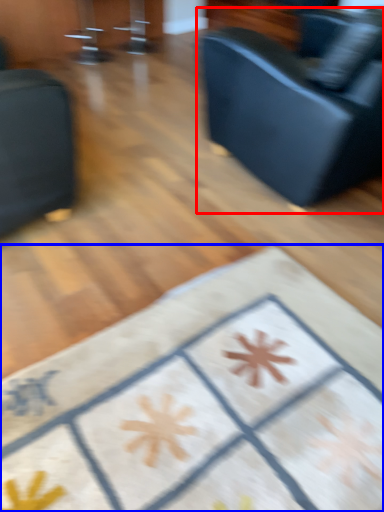
Question: Which object appears farthest to the camera in this image, studio couch (highlighted by a red box) or furniture (highlighted by a blue box)?

Choices:
 (A) studio couch
 (B) furniture

Answer: (A)